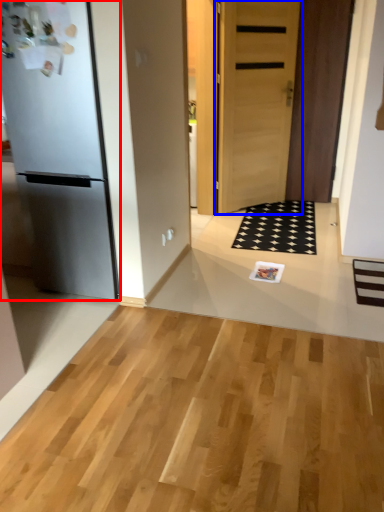
Question: Which object is further to the camera taking this photo, refrigerator (highlighted by a red box) or door (highlighted by a blue box)?

Choices:
 (A) refrigerator
 (B) door

Answer: (B)